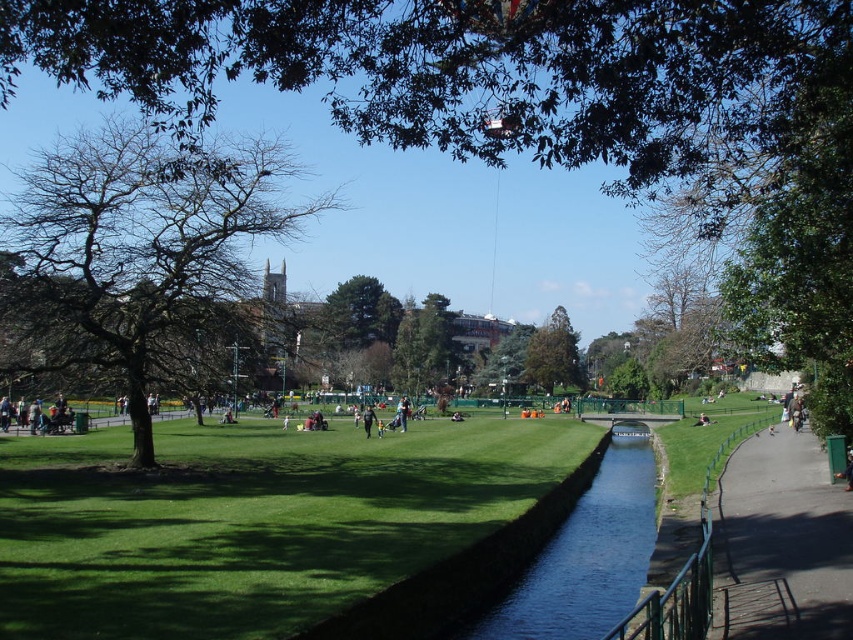
Question: Which object appears farthest from the camera in this image?

Choices:
 (A) green metal fence at lower right
 (B) brown leafy tree at left

Answer: (B)

Question: In this image, where is green metal fence at lower right located relative to light blue denim jeans at center?

Choices:
 (A) left
 (B) right

Answer: (B)

Question: Does green grass at center have a smaller size compared to black matte person at center?

Choices:
 (A) yes
 (B) no

Answer: (B)

Question: Which point is closer to the camera?

Choices:
 (A) (321, 467)
 (B) (370, 428)
 (C) (554, 381)
 (D) (402, 416)

Answer: (A)

Question: Among these objects, which one is nearest to the camera?

Choices:
 (A) black matte person at center
 (B) brown leafy tree at left
 (C) clear water at center
 (D) light blue denim jeans at center

Answer: (B)

Question: Is green leafy tree at upper left further to the viewer compared to black matte person at center?

Choices:
 (A) yes
 (B) no

Answer: (B)